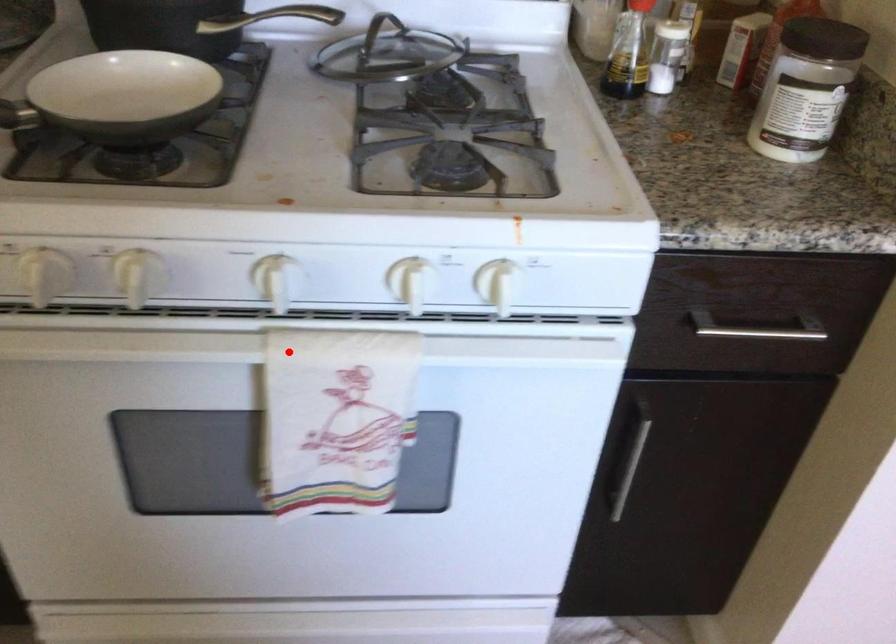
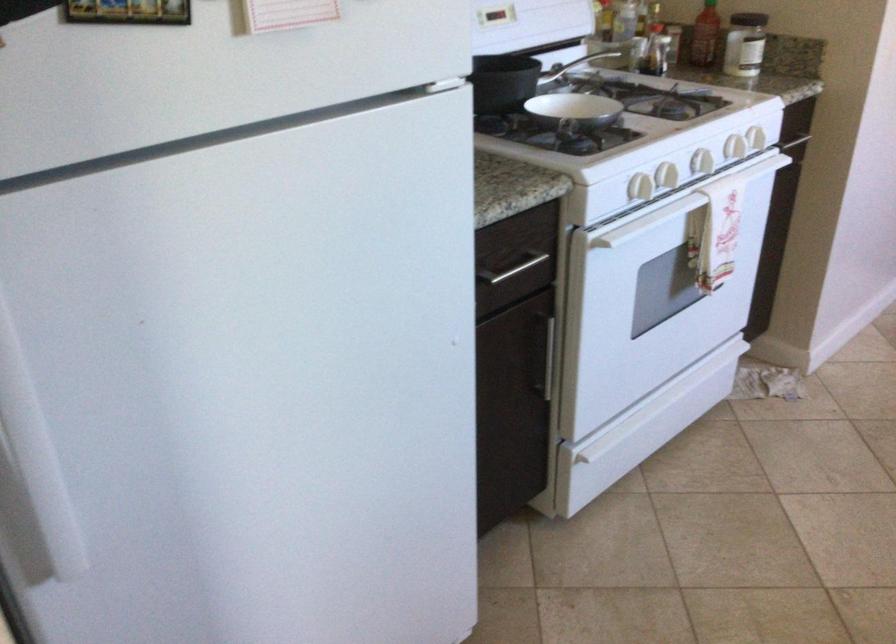
In the second image, find the point that corresponds to the highlighted location in the first image.

(734, 147)